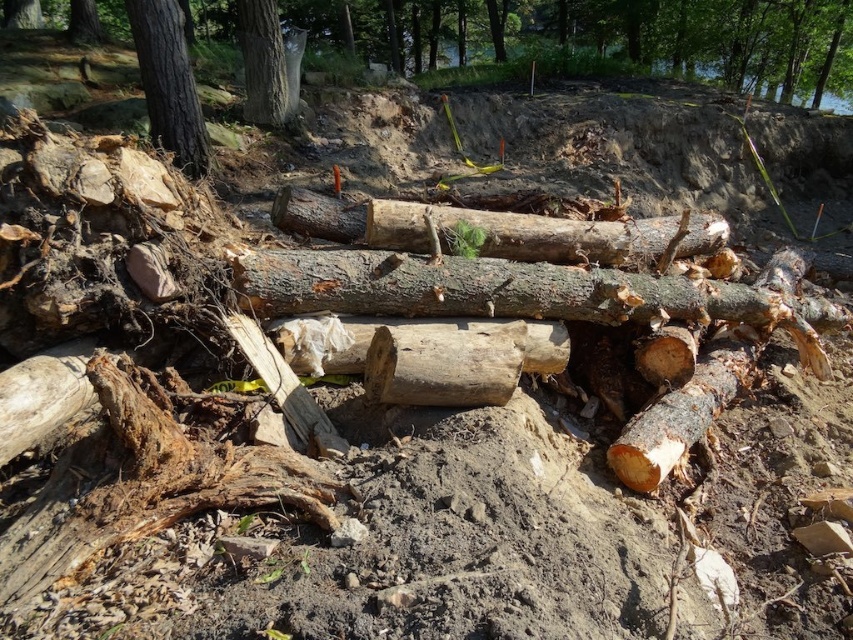
Looking at this image, you are a construction worker standing at the origin point of the coordinate system. You need to place a new wooden beam at the natural wood log at center. What are the coordinates where you should place it?

The coordinates for placing the natural wood log at center are at point (471, 225).

You are a construction worker who needs to stack materials. You have a natural wood log at center and a smooth gray bark at upper left. Which object is shorter?

The natural wood log at center is shorter than the smooth gray bark at upper left.

In the scene shown: You are a construction worker who needs to move the natural wood log at center and the smooth gray bark at upper left to a different location. If you start at the upper left corner of the image, which object should you move first to reach the other without going around obstacles?

You should move the smooth gray bark at upper left first because it is located to the left of the natural wood log at center. By moving it first, you can then access the natural wood log at center more easily without needing to go around obstacles.